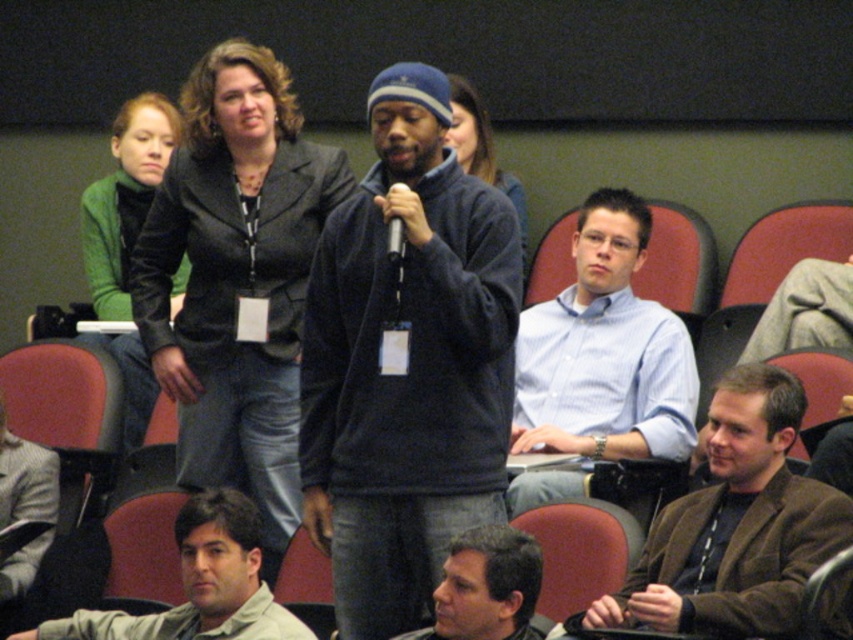
You are sitting in the front row of the conference and want to ask a question to the speaker. You see the brown leather jacket at lower right and the blue shirt at center. Which one is closer to you?

The brown leather jacket at lower right is closer to the viewer than the blue shirt at center, so the brown leather jacket at lower right is closer to you.